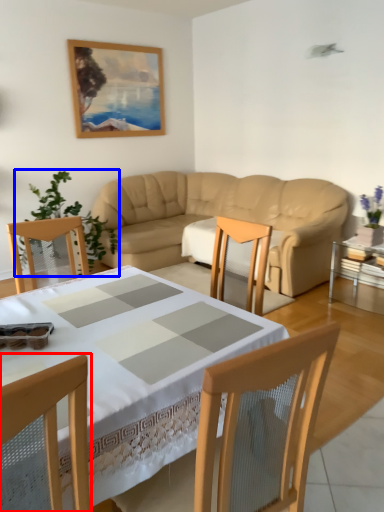
Question: Which object appears farthest to the camera in this image, chair (highlighted by a red box) or plant (highlighted by a blue box)?

Choices:
 (A) chair
 (B) plant

Answer: (B)